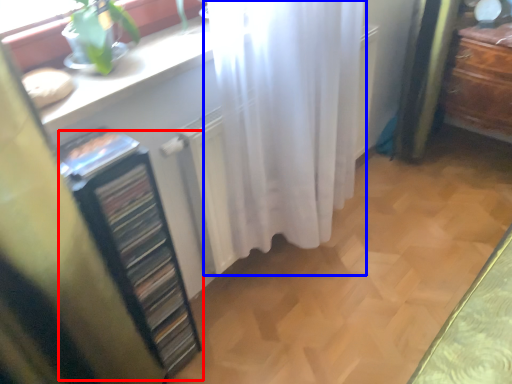
Question: Which of the following is the closest to the observer, file cabinet (highlighted by a red box) or curtain (highlighted by a blue box)?

Choices:
 (A) file cabinet
 (B) curtain

Answer: (A)